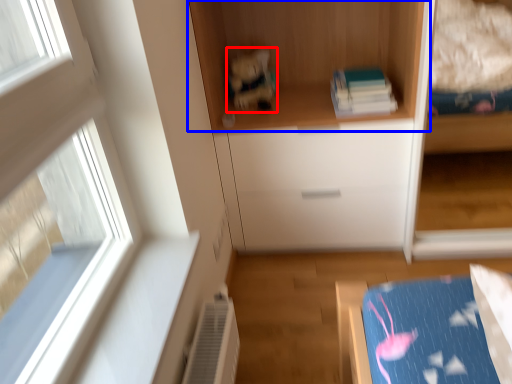
Question: Which object is closer to the camera taking this photo, toy (highlighted by a red box) or cupboard (highlighted by a blue box)?

Choices:
 (A) toy
 (B) cupboard

Answer: (B)